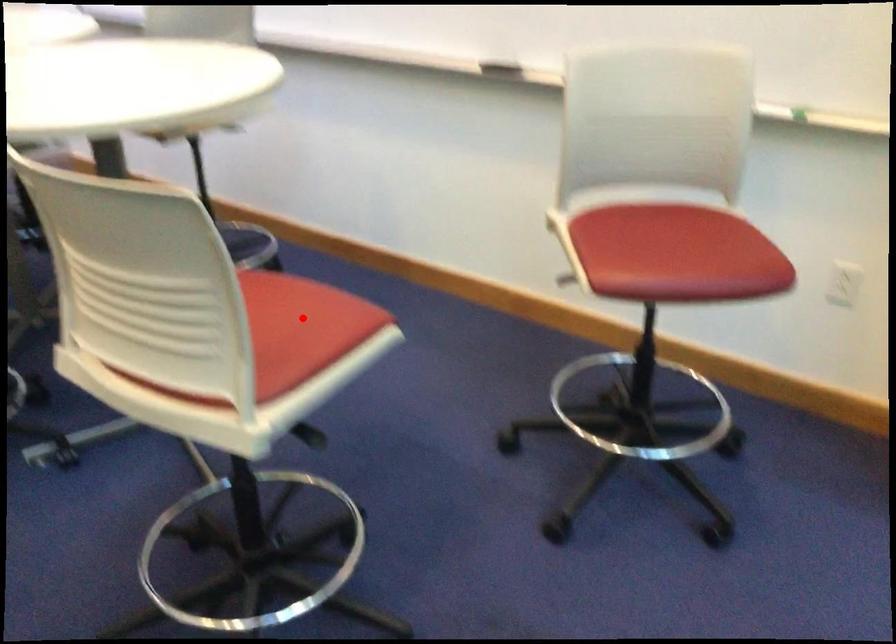
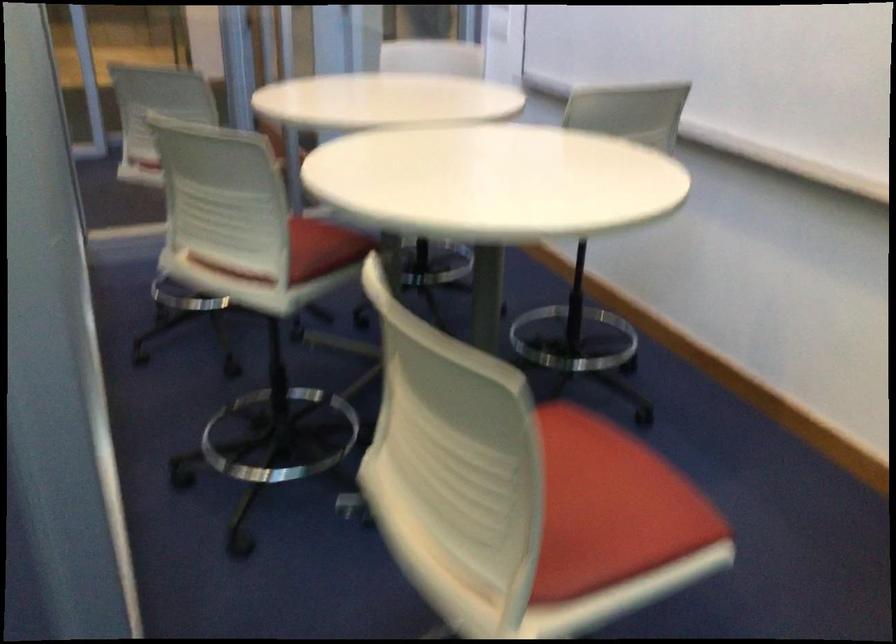
Question: I am providing you with two images of the same scene from different viewpoints. A red point is marked on the first image. Can you still see the location of the red point in image 2?

Choices:
 (A) Yes
 (B) No

Answer: (A)